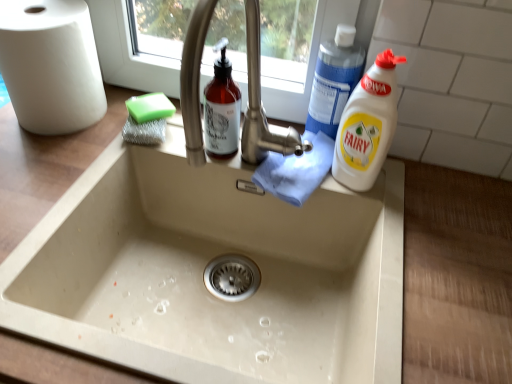
You are a GUI agent. You are given a task and a screenshot of the screen. Output one action in this format:
    pyautogui.click(x=<x>, y=<y>)
    Task: Click on the vacant space in front of green sponge at upper left
    The width and height of the screenshot is (512, 384).
    Given the screenshot: What is the action you would take?
    pyautogui.click(x=100, y=169)